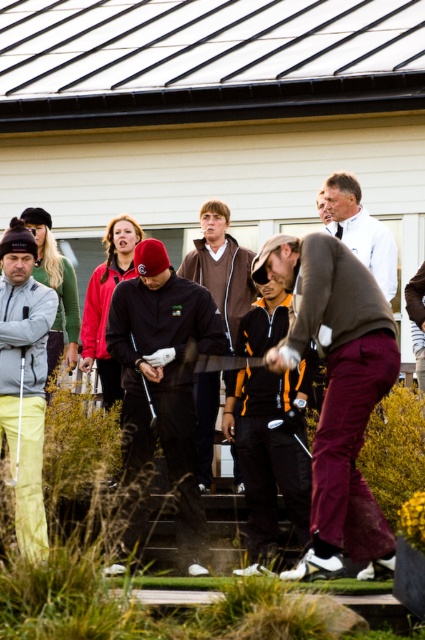
Question: Can you confirm if dark brown sweater at center is positioned above white shirt at upper center?

Choices:
 (A) no
 (B) yes

Answer: (A)

Question: Is matte gray jacket at left above dark brown sweater at center?

Choices:
 (A) yes
 (B) no

Answer: (B)

Question: Which point is farther from the camera taking this photo?

Choices:
 (A) (121, 342)
 (B) (371, 292)

Answer: (A)

Question: Among these points, which one is nearest to the camera?

Choices:
 (A) (255, 492)
 (B) (22, 358)

Answer: (A)

Question: Among these points, which one is farthest from the camera?

Choices:
 (A) (39, 454)
 (B) (127, 474)
 (C) (203, 374)
 (D) (337, 232)

Answer: (D)

Question: Is the position of dark brown sweater at center less distant than that of matte black golf club at center?

Choices:
 (A) yes
 (B) no

Answer: (B)